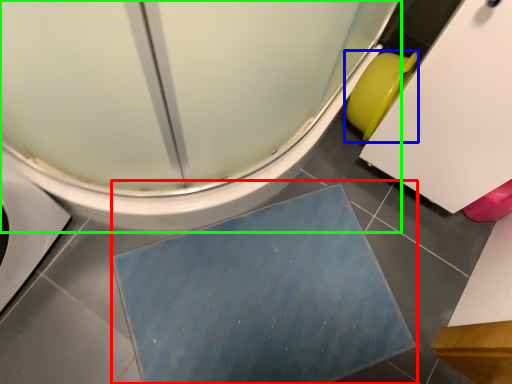
Question: Which is farther away from bath mat (highlighted by a red box)? toilet bowl (highlighted by a blue box) or toilet (highlighted by a green box)?

Choices:
 (A) toilet bowl
 (B) toilet

Answer: (A)